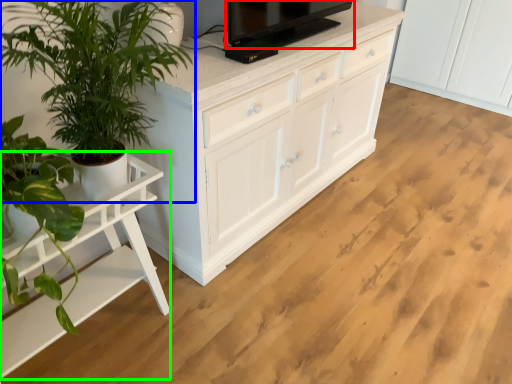
Question: Estimate the real-world distances between objects in this image. Which object is closer to television (highlighted by a red box), houseplant (highlighted by a blue box) or table (highlighted by a green box)?

Choices:
 (A) houseplant
 (B) table

Answer: (A)